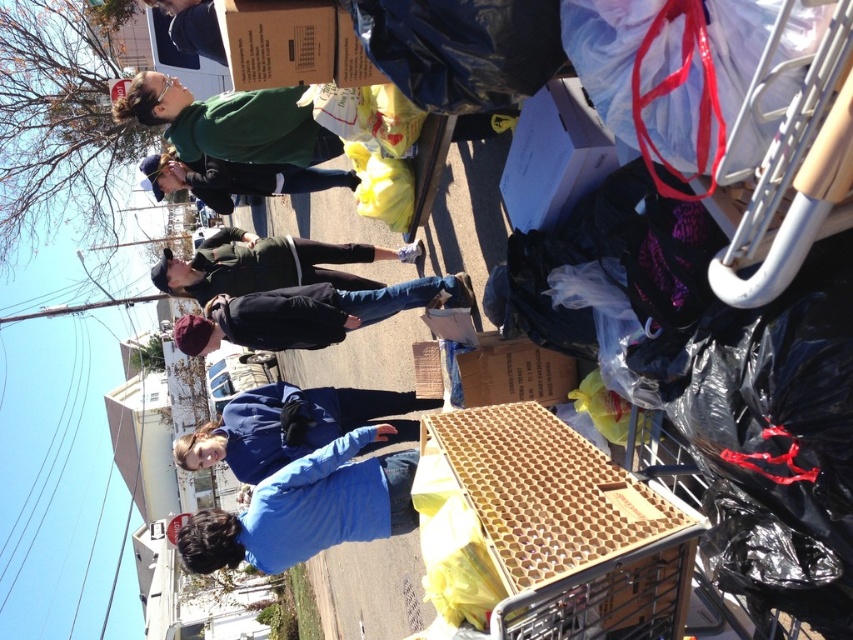
Looking at this image, can you confirm if wooden crate at center is thinner than brown cardboard box at center?

No.

The height and width of the screenshot is (640, 853). In order to click on wooden crate at center in this screenshot , I will do `click(567, 528)`.

Is point (685, 524) positioned after point (479, 388)?

No, (685, 524) is in front of (479, 388).

Image resolution: width=853 pixels, height=640 pixels. Identify the location of wooden crate at center. (567, 528).

Is blue fleece jacket at center above green matte jacket at upper center?

No.

How far apart are blue fleece jacket at center and green matte jacket at upper center?

A distance of 6.49 feet exists between blue fleece jacket at center and green matte jacket at upper center.

Between point (280, 416) and point (283, 120), which one is positioned behind?

The point (280, 416) is more distant.

Locate an element on the screen. blue fleece jacket at center is located at coordinates (285, 426).

Between point (293, 52) and point (184, 173), which one is positioned in front?

Point (293, 52) is more forward.

Based on the photo, is cardboard box at upper center to the right of matte black jacket at upper center from the viewer's perspective?

Yes, cardboard box at upper center is to the right of matte black jacket at upper center.

The height and width of the screenshot is (640, 853). I want to click on cardboard box at upper center, so pos(291,44).